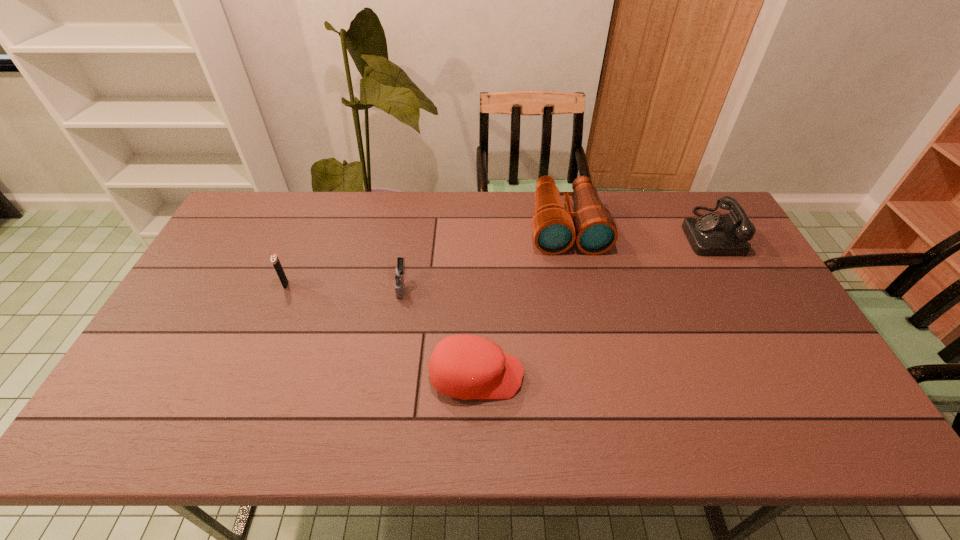
Image resolution: width=960 pixels, height=540 pixels. In order to click on binoculars in this screenshot , I will do `click(555, 229)`.

Find the location of a particular element. telephone is located at coordinates (710, 234).

You are a GUI agent. You are given a task and a screenshot of the screen. Output one action in this format:
    pyautogui.click(x=<x>, y=<y>)
    Task: Click on the left igniter
    This screenshot has height=540, width=960.
    Given the screenshot: What is the action you would take?
    pyautogui.click(x=275, y=261)

You are a GUI agent. You are given a task and a screenshot of the screen. Output one action in this format:
    pyautogui.click(x=<x>, y=<y>)
    Task: Click on the right igniter
    
    Given the screenshot: What is the action you would take?
    pyautogui.click(x=398, y=272)

This screenshot has width=960, height=540. What are the coordinates of `the nearest object` in the screenshot? It's located at (465, 367).

The image size is (960, 540). Identify the location of the third object from right to left. (465, 367).

This screenshot has width=960, height=540. I want to click on vacant area situated through the lenses of the binoculars, so click(579, 286).

This screenshot has height=540, width=960. What are the coordinates of `vacant space situated on the dial of the rightmost object` in the screenshot? It's located at (621, 232).

You are a GUI agent. You are given a task and a screenshot of the screen. Output one action in this format:
    pyautogui.click(x=<x>, y=<y>)
    Task: Click on the free space located on the dial of the rightmost object
    
    Given the screenshot: What is the action you would take?
    pyautogui.click(x=603, y=232)

The image size is (960, 540). In order to click on blank space located on the dial of the rightmost object in this screenshot , I will do `click(582, 232)`.